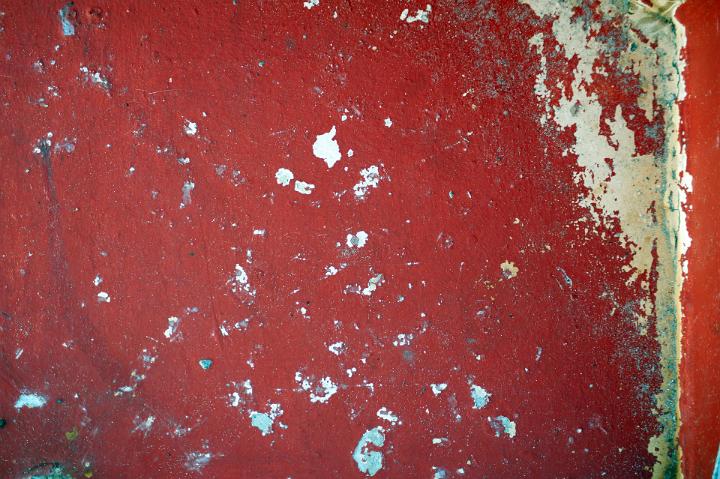
You are a GUI agent. You are given a task and a screenshot of the screen. Output one action in this format:
    pyautogui.click(x=<x>, y=<y>)
    Task: Click on the red paint
    The image size is (720, 479).
    Given the screenshot: What is the action you would take?
    pyautogui.click(x=697, y=300)